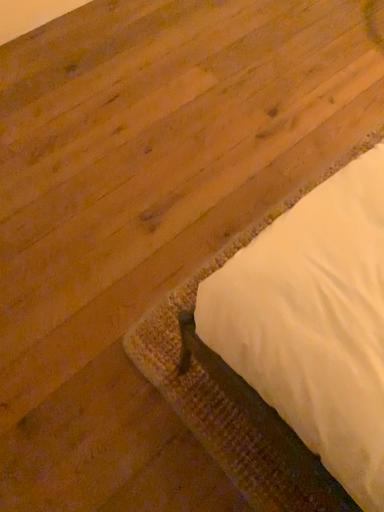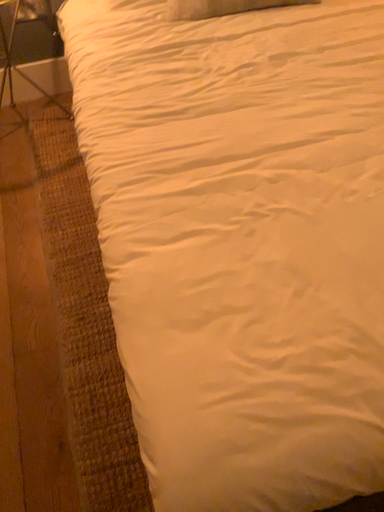
Question: How did the camera likely rotate when shooting the video?

Choices:
 (A) rotated downward
 (B) rotated upward

Answer: (B)